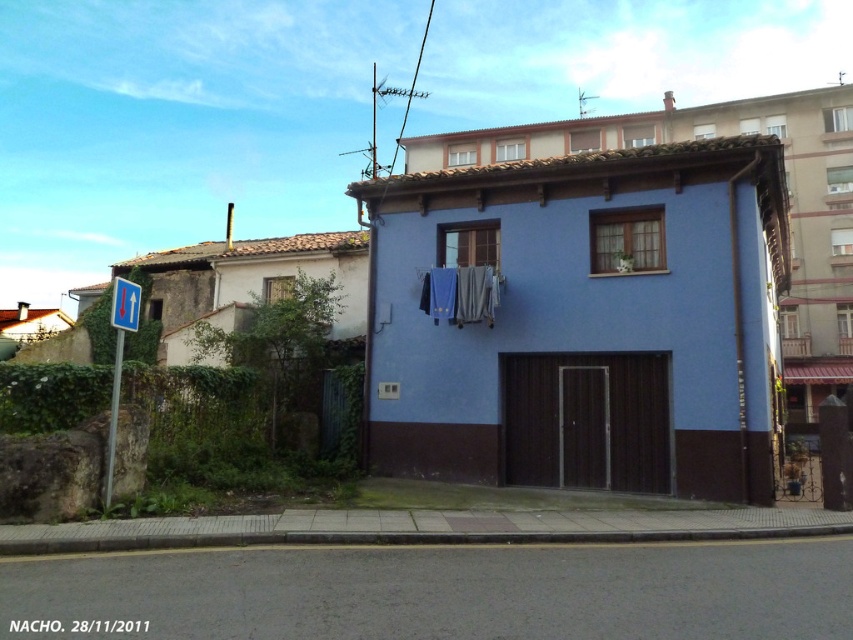
Question: Which of the following is the farthest from the observer?

Choices:
 (A) blue plastic sign at left
 (B) blue fabric laundry at center

Answer: (B)

Question: Among these points, which one is nearest to the camera?

Choices:
 (A) (120, 304)
 (B) (476, 288)

Answer: (A)

Question: Is the position of blue fabric laundry at center less distant than that of blue plastic sign at left?

Choices:
 (A) no
 (B) yes

Answer: (A)

Question: Which point is closer to the camera taking this photo?

Choices:
 (A) (114, 356)
 (B) (465, 307)

Answer: (B)

Question: Is blue fabric laundry at center smaller than blue plastic sign at left?

Choices:
 (A) yes
 (B) no

Answer: (A)

Question: In this image, where is blue fabric laundry at center located relative to blue plastic sign at left?

Choices:
 (A) above
 (B) below

Answer: (A)